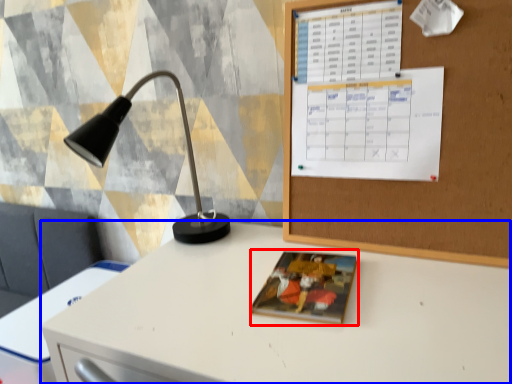
Question: Which object is further to the camera taking this photo, book cover (highlighted by a red box) or desk (highlighted by a blue box)?

Choices:
 (A) book cover
 (B) desk

Answer: (A)